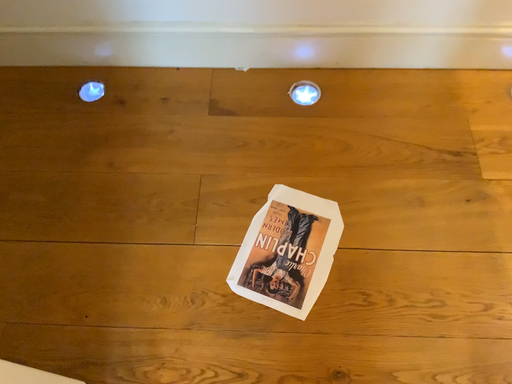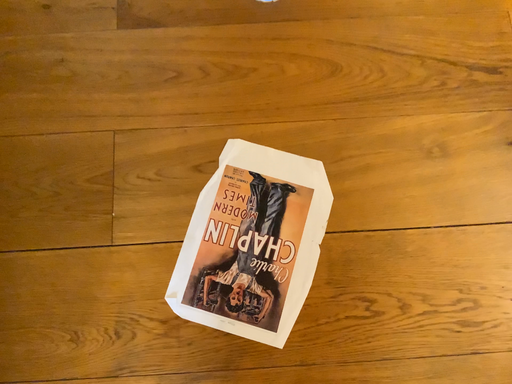
Question: How did the camera likely rotate when shooting the video?

Choices:
 (A) rotated downward
 (B) rotated upward

Answer: (A)